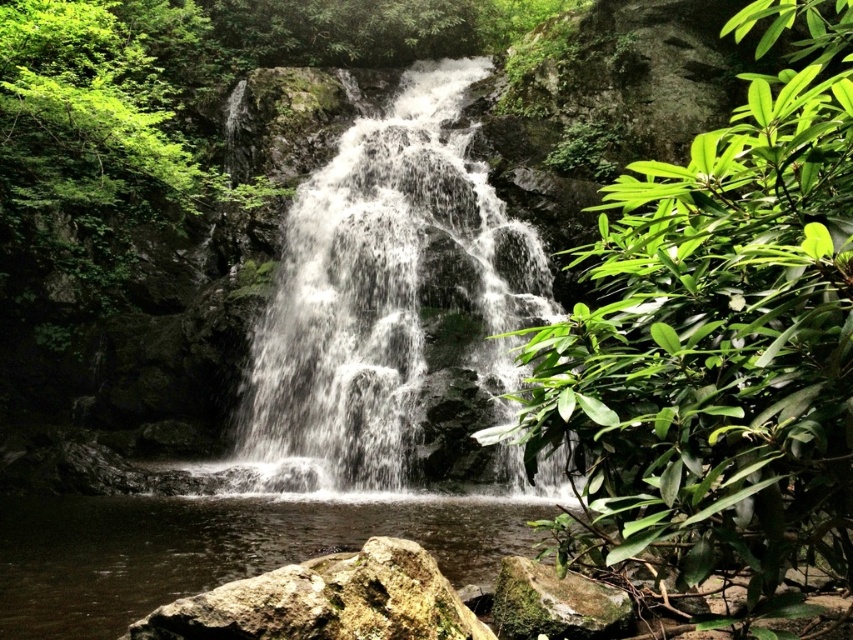
Based on the photo, you are standing at the base of the waterfall and want to take a photo that includes both the point at coordinates point (804,179) and the point at coordinates point (578,612). Based on their positions, which point should be closer to you when framing the shot?

Point (804,179) is in front of point (578,612), so when framing the shot, point (804,179) will be closer to you.